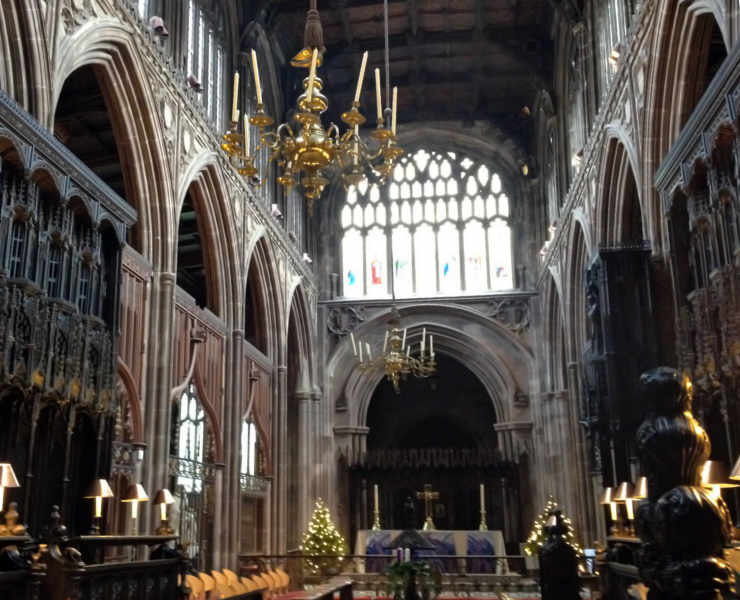
Identify the location of candles. This screenshot has width=740, height=600. pyautogui.click(x=377, y=500), pyautogui.click(x=482, y=505).